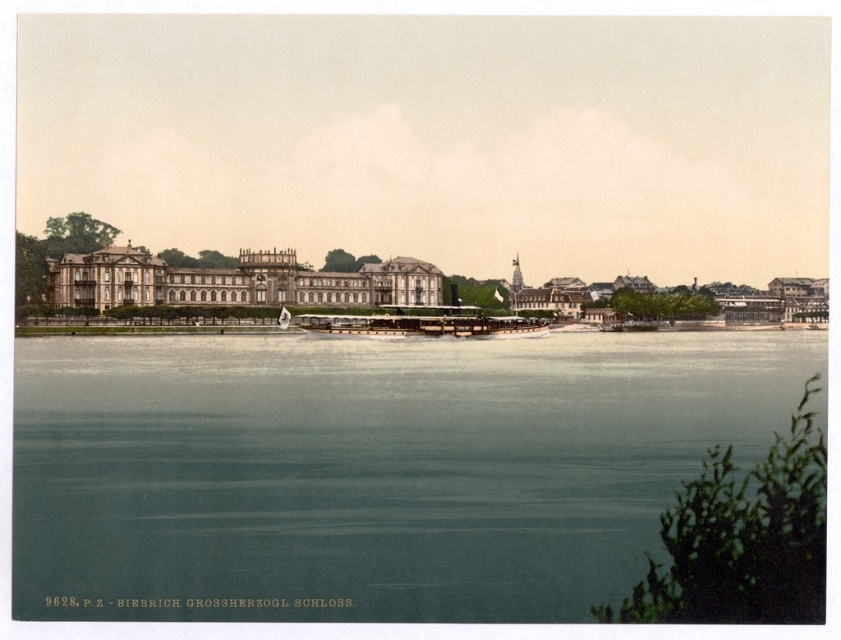
Question: Estimate the real-world distances between objects in this image. Which object is closer to the blue-green water at center?

Choices:
 (A) beige stone palace at center
 (B) wooden polished boat at center

Answer: (B)

Question: Among these objects, which one is farthest from the camera?

Choices:
 (A) beige stone palace at center
 (B) blue-green water at center

Answer: (A)

Question: Is beige stone palace at center closer to the viewer compared to wooden polished boat at center?

Choices:
 (A) no
 (B) yes

Answer: (B)

Question: Observing the image, what is the correct spatial positioning of blue-green water at center in reference to beige stone palace at center?

Choices:
 (A) above
 (B) below

Answer: (B)

Question: Which object is farther from the camera taking this photo?

Choices:
 (A) beige stone palace at center
 (B) wooden polished boat at center
 (C) blue-green water at center

Answer: (B)

Question: Is beige stone palace at center bigger than wooden polished boat at center?

Choices:
 (A) no
 (B) yes

Answer: (B)